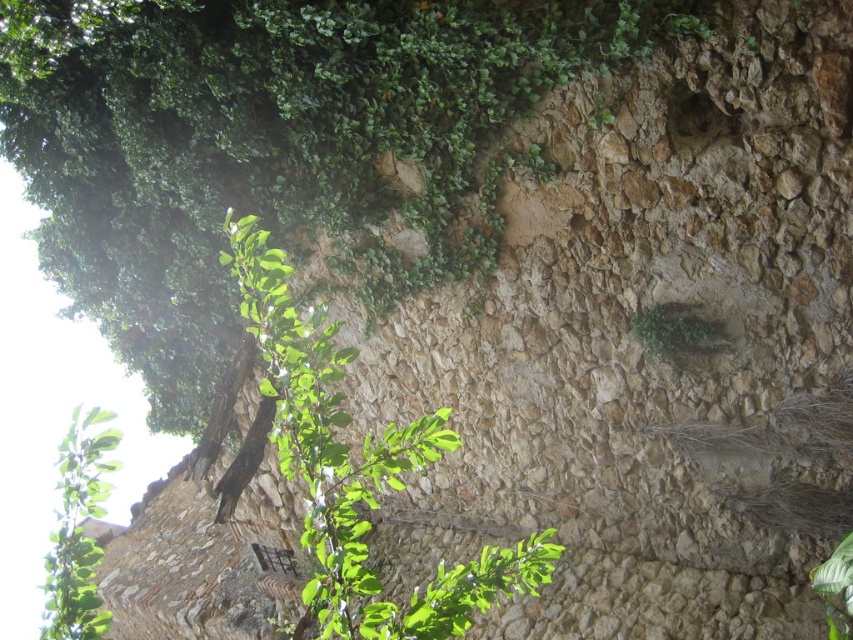
Is the position of green leafy branch at upper left less distant than that of green leafy plant at center?

Yes, green leafy branch at upper left is in front of green leafy plant at center.

Does green leafy branch at upper left appear over green leafy plant at center?

No.

Where is `green leafy branch at upper left`? Image resolution: width=853 pixels, height=640 pixels. green leafy branch at upper left is located at coordinates (78, 531).

Locate an element on the screen. green leafy branch at upper left is located at coordinates (78, 531).